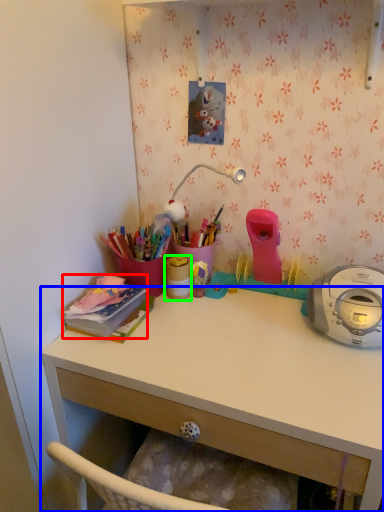
Question: Estimate the real-world distances between objects in this image. Which object is closer to office supplies (highlighted by a red box), desk (highlighted by a blue box) or office supplies (highlighted by a green box)?

Choices:
 (A) desk
 (B) office supplies

Answer: (B)